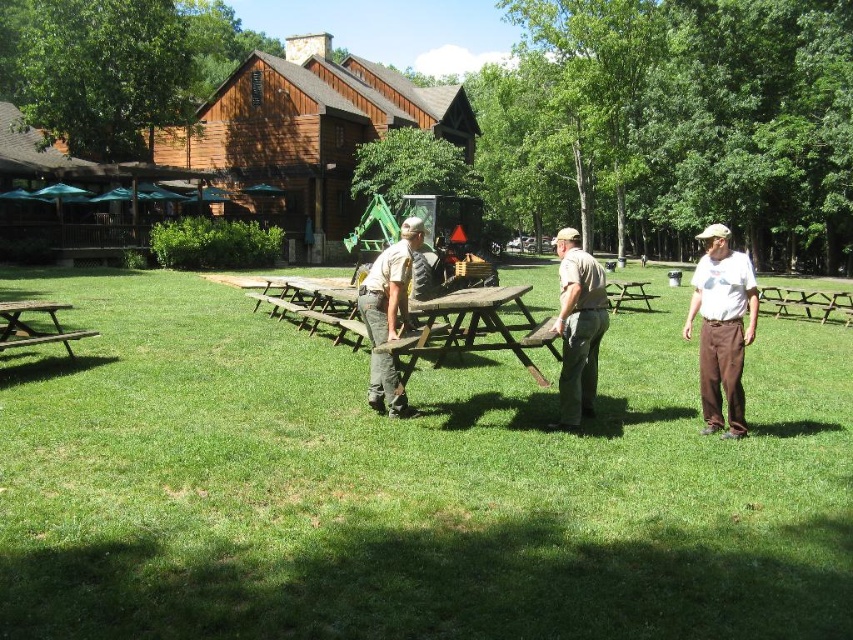
Does green grass at center appear on the right side of khaki uniform pants at center?

No, green grass at center is not to the right of khaki uniform pants at center.

Can you confirm if green grass at center is wider than khaki uniform pants at center?

Yes.

Find the location of a particular element. This screenshot has width=853, height=640. green grass at center is located at coordinates (409, 484).

Identify the location of green grass at center. (409, 484).

Can you confirm if white cotton shirt at center is smaller than wooden picnic table at left?

Actually, white cotton shirt at center might be larger than wooden picnic table at left.

From the picture: Can you confirm if white cotton shirt at center is positioned below wooden picnic table at left?

No.

Is point (705, 387) less distant than point (50, 317)?

That is True.

You are a GUI agent. You are given a task and a screenshot of the screen. Output one action in this format:
    pyautogui.click(x=<x>, y=<y>)
    Task: Click on the white cotton shirt at center
    
    Given the screenshot: What is the action you would take?
    tap(722, 326)

Can you confirm if green grass at center is positioned above brown wood picnic table at center?

No.

Between green grass at center and brown wood picnic table at center, which one has less height?

brown wood picnic table at center

Which is behind, point (451, 483) or point (457, 340)?

Point (457, 340)

Locate an element on the screen. green grass at center is located at coordinates (409, 484).